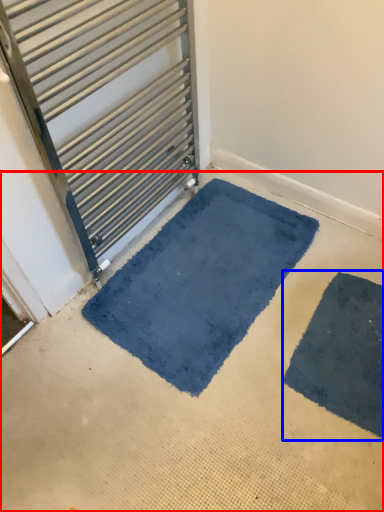
Question: Which point is further to the camera, concrete (highlighted by a red box) or bath mat (highlighted by a blue box)?

Choices:
 (A) concrete
 (B) bath mat

Answer: (B)